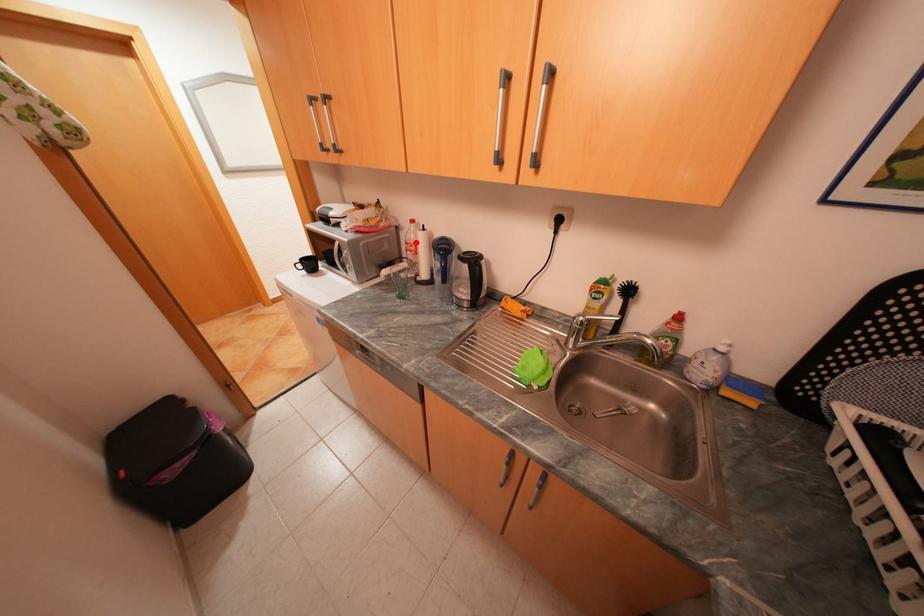
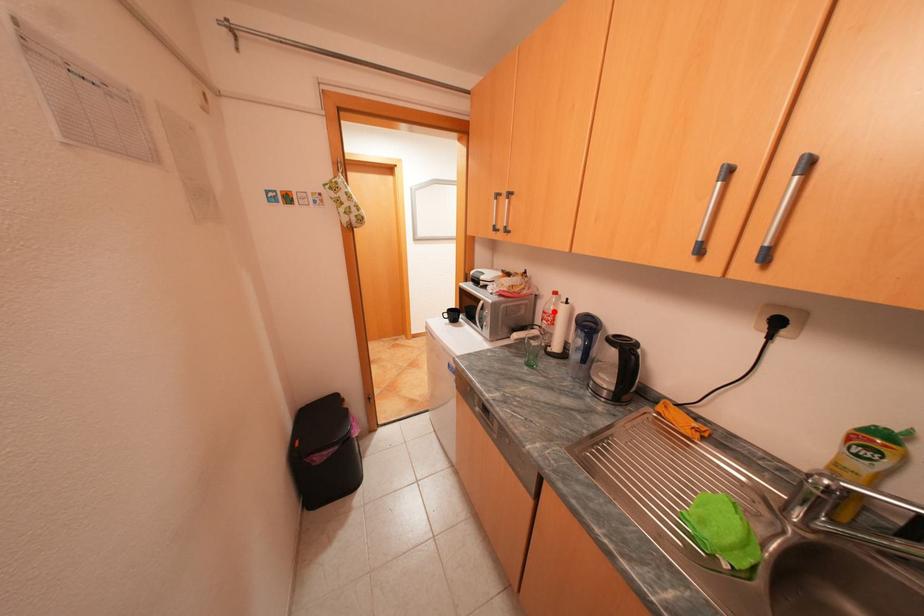
I am providing you with two images of the same scene from different viewpoints. A red point is marked on the first image and another point is marked on the second image. Is the red point in image1 aligned with the point shown in image2?

Yes